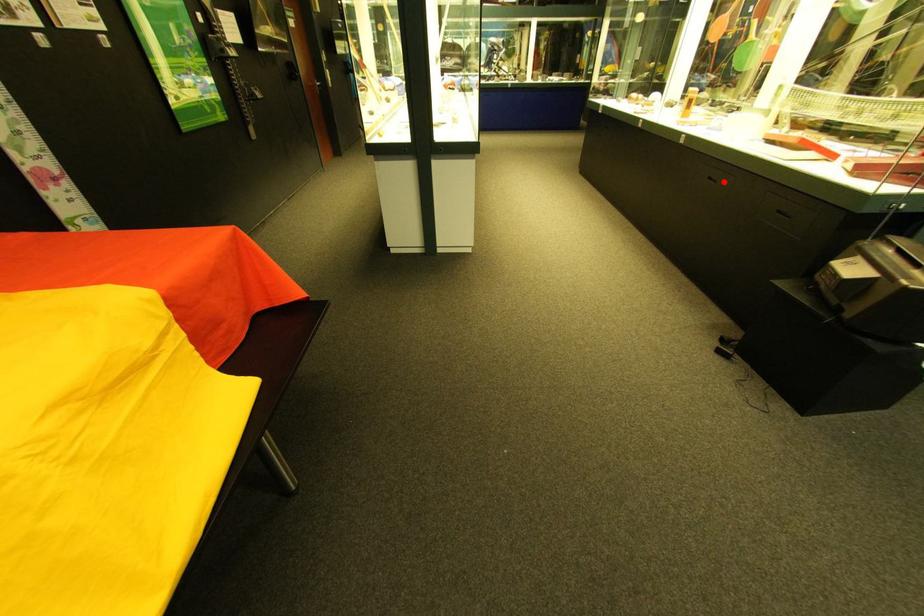
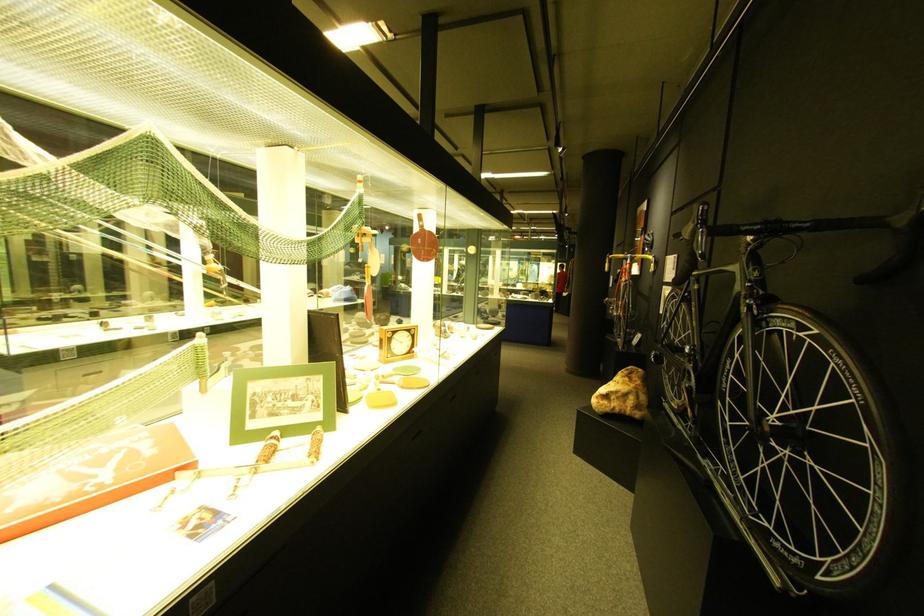
Question: I am providing you with two images of the same scene from different viewpoints. A red point is marked on the first image. Is the red point's position out of view in image 2?

Choices:
 (A) Yes
 (B) No

Answer: (A)